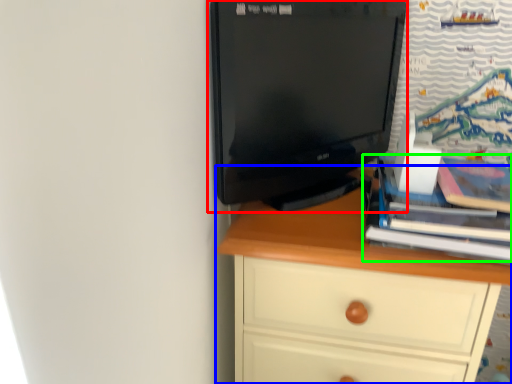
Question: Based on their relative distances, which object is nearer to computer monitor (highlighted by a red box)? Choose from chest of drawers (highlighted by a blue box) and book (highlighted by a green box).

Choices:
 (A) chest of drawers
 (B) book

Answer: (A)